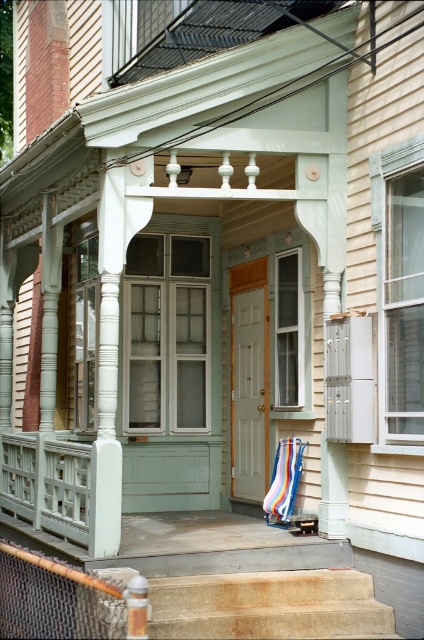
You are planning to place the striped fabric beach chair at center on the porch. Given that the smooth stone stairs at center already occupies the central area, will the chair fit without overlapping the stairs?

The smooth stone stairs at center is bigger than striped fabric beach chair at center, so placing the chair at the same central area may cause overlapping since the stairs take up more space.

You are a delivery person trying to place a package on the smooth stone stairs at center and the striped fabric beach chair at center. Which surface can you place the package on without it rolling off?

The striped fabric beach chair at center has a greater height than the smooth stone stairs at center, so placing the package on the striped fabric beach chair at center would be safer to prevent it from rolling off.